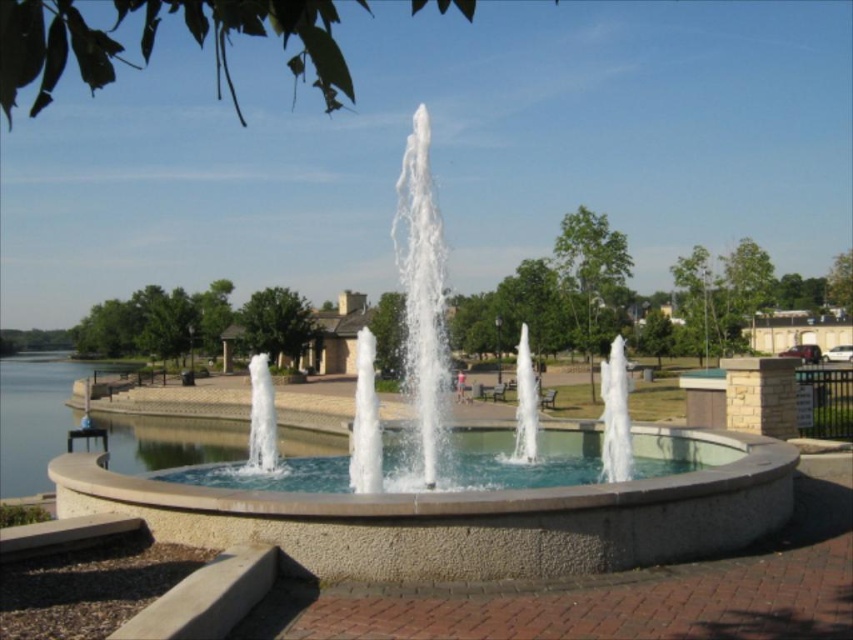
Question: Can you confirm if white stone fountain at center is positioned to the right of clear glass water at center?

Choices:
 (A) yes
 (B) no

Answer: (B)

Question: Which object is farther from the camera taking this photo?

Choices:
 (A) clear glass water at center
 (B) white stone fountain at center

Answer: (A)

Question: Which object appears closest to the camera in this image?

Choices:
 (A) clear glass water at center
 (B) white stone fountain at center

Answer: (B)

Question: In this image, where is white stone fountain at center located relative to clear glass water at center?

Choices:
 (A) above
 (B) below

Answer: (A)

Question: Is white stone fountain at center to the left of clear glass water at center from the viewer's perspective?

Choices:
 (A) yes
 (B) no

Answer: (A)